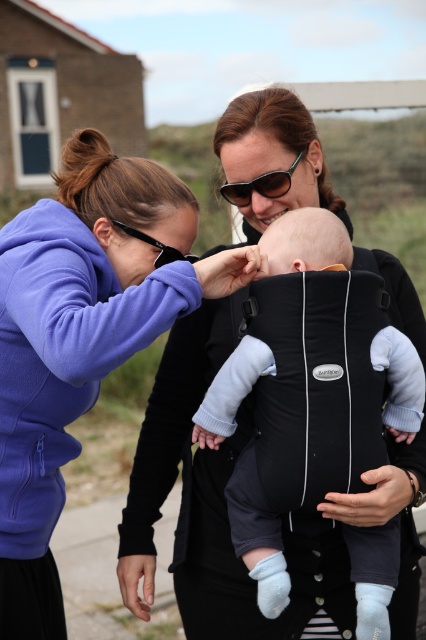
Does purple fleece sweatshirt at left have a greater width compared to black plastic goggles at upper center?

Correct, the width of purple fleece sweatshirt at left exceeds that of black plastic goggles at upper center.

Is purple fleece sweatshirt at left taller than black plastic goggles at upper center?

Yes, purple fleece sweatshirt at left is taller than black plastic goggles at upper center.

Describe the element at coordinates (63, 353) in the screenshot. I see `purple fleece sweatshirt at left` at that location.

Where is `purple fleece sweatshirt at left`? purple fleece sweatshirt at left is located at coordinates (63, 353).

Who is higher up, sunglasses at center or black plastic goggles at upper center?

sunglasses at center

Which is below, sunglasses at center or black plastic goggles at upper center?

black plastic goggles at upper center is below.

Does point (264, 179) come farther from viewer compared to point (115, 225)?

Yes, it is.

Locate an element on the screen. The width and height of the screenshot is (426, 640). sunglasses at center is located at coordinates (259, 186).

Locate an element on the screen. Image resolution: width=426 pixels, height=640 pixels. black fabric carrier at center is located at coordinates (258, 532).

Does point (290, 227) come closer to viewer compared to point (121, 225)?

That is True.

Identify the location of black fabric carrier at center. This screenshot has width=426, height=640. (258, 532).